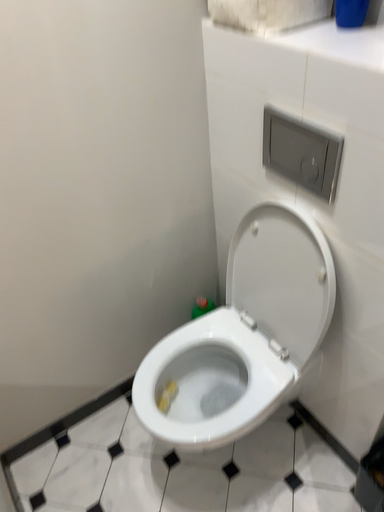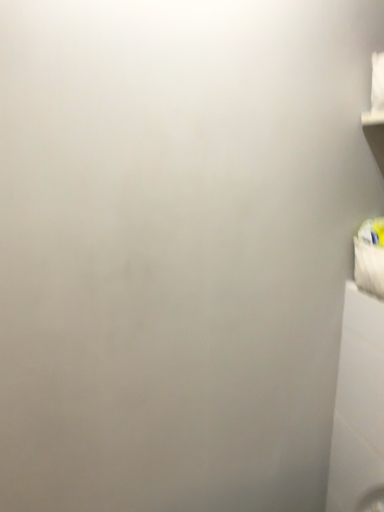
Question: Which way did the camera rotate in the video?

Choices:
 (A) rotated upward
 (B) rotated downward

Answer: (A)